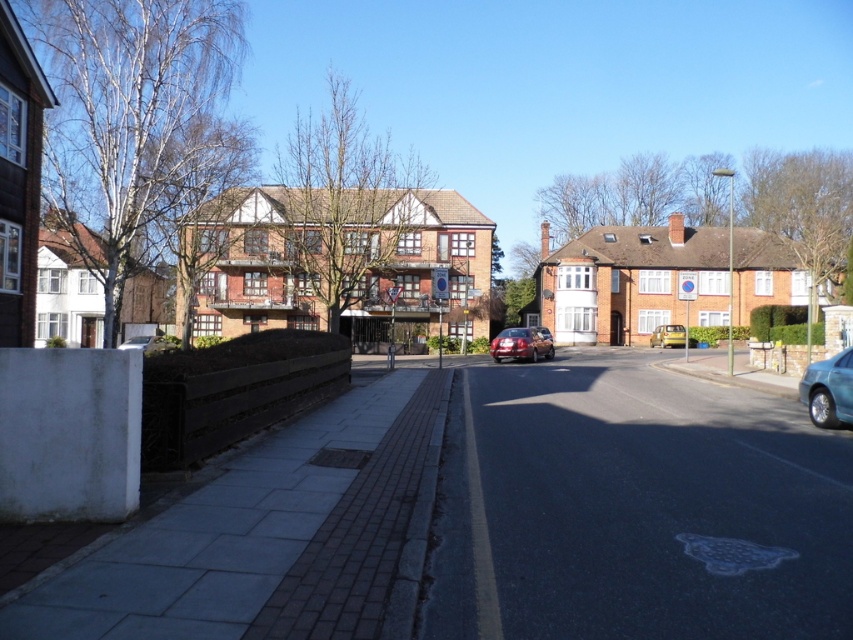
From the picture: You are a delivery person trying to park your matte silver car at lower left between two parked vehicles. The yellow matte van at center is already occupying a spot. Can you fit your car in the remaining space if the van is taking up more space than your car?

The yellow matte van at center is bigger than the matte silver car at lower left, so the remaining space might be sufficient for the matte silver car at lower left to park, but it depends on the exact dimensions of the available space.

You are a delivery driver who needs to park your vehicle between the two vehicles in the scene. The satin red sedan at center and the yellow matte van at center are both parked on the same side of the street. Given that your vehicle is 2 meters wide, can you safely park between them without overlapping either vehicle?

The satin red sedan at center is thinner than the yellow matte van at center. Since the sedan is thinner, the space between them may be narrower than the van. However, without knowing the exact distance between the two vehicles, it is impossible to determine if your 2 meter wide vehicle can fit safely. You should check the available space before attempting to park.